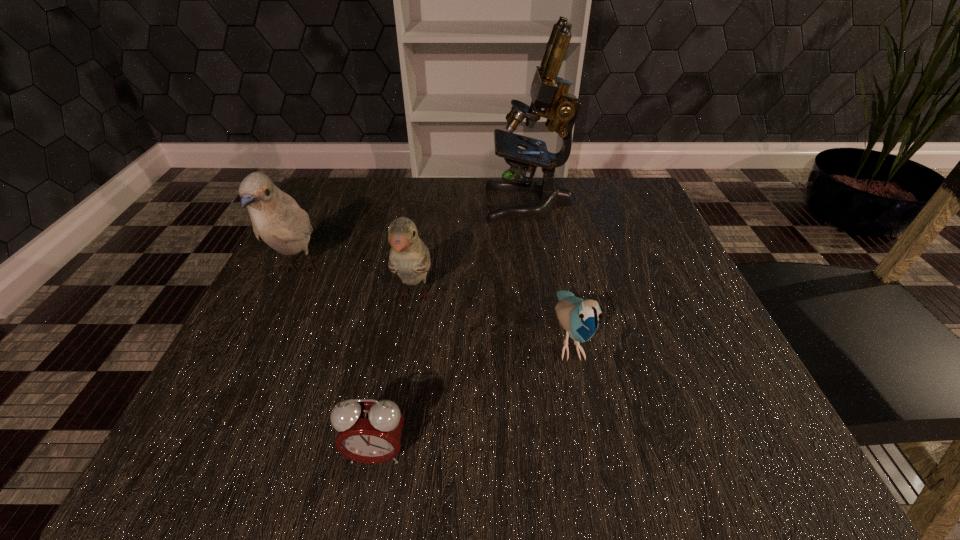
Where is `vacant area that satisfies the following two spatial constraints: 1. at the eyepieces of the tallest object; 2. at the beak of the tallest bird`? This screenshot has height=540, width=960. vacant area that satisfies the following two spatial constraints: 1. at the eyepieces of the tallest object; 2. at the beak of the tallest bird is located at coordinates [x=540, y=269].